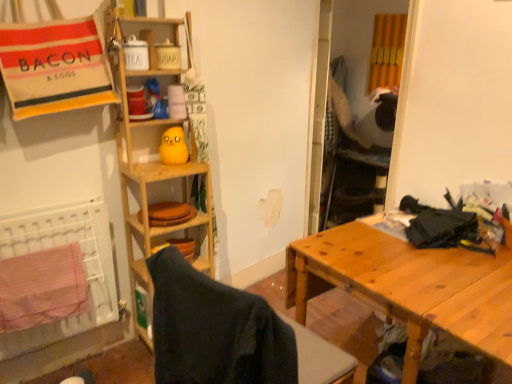
Question: Is yellow matte plush toy at upper center taller than red checkered beach towel at lower left?

Choices:
 (A) no
 (B) yes

Answer: (A)

Question: Is yellow matte plush toy at upper center not near red checkered beach towel at lower left?

Choices:
 (A) no
 (B) yes

Answer: (A)

Question: Does yellow matte plush toy at upper center come in front of red checkered beach towel at lower left?

Choices:
 (A) no
 (B) yes

Answer: (A)

Question: Does yellow matte plush toy at upper center have a smaller size compared to red checkered beach towel at lower left?

Choices:
 (A) yes
 (B) no

Answer: (A)

Question: Is yellow matte plush toy at upper center thinner than red checkered beach towel at lower left?

Choices:
 (A) yes
 (B) no

Answer: (A)

Question: Would you say yellow matte plush toy at upper center is outside red checkered beach towel at lower left?

Choices:
 (A) yes
 (B) no

Answer: (A)

Question: From a real-world perspective, does red checkered beach towel at lower left stand above wooden table at right?

Choices:
 (A) no
 (B) yes

Answer: (B)

Question: Considering the relative sizes of red checkered beach towel at lower left and wooden table at right in the image provided, is red checkered beach towel at lower left wider than wooden table at right?

Choices:
 (A) yes
 (B) no

Answer: (B)

Question: From a real-world perspective, is red checkered beach towel at lower left below wooden table at right?

Choices:
 (A) yes
 (B) no

Answer: (B)

Question: Considering the relative sizes of red checkered beach towel at lower left and wooden table at right in the image provided, is red checkered beach towel at lower left bigger than wooden table at right?

Choices:
 (A) yes
 (B) no

Answer: (B)

Question: Is the position of red checkered beach towel at lower left more distant than that of wooden table at right?

Choices:
 (A) yes
 (B) no

Answer: (A)

Question: Does red checkered beach towel at lower left appear on the right side of wooden table at right?

Choices:
 (A) no
 (B) yes

Answer: (A)

Question: Is wooden table at right thinner than wooden shelf at center?

Choices:
 (A) yes
 (B) no

Answer: (B)